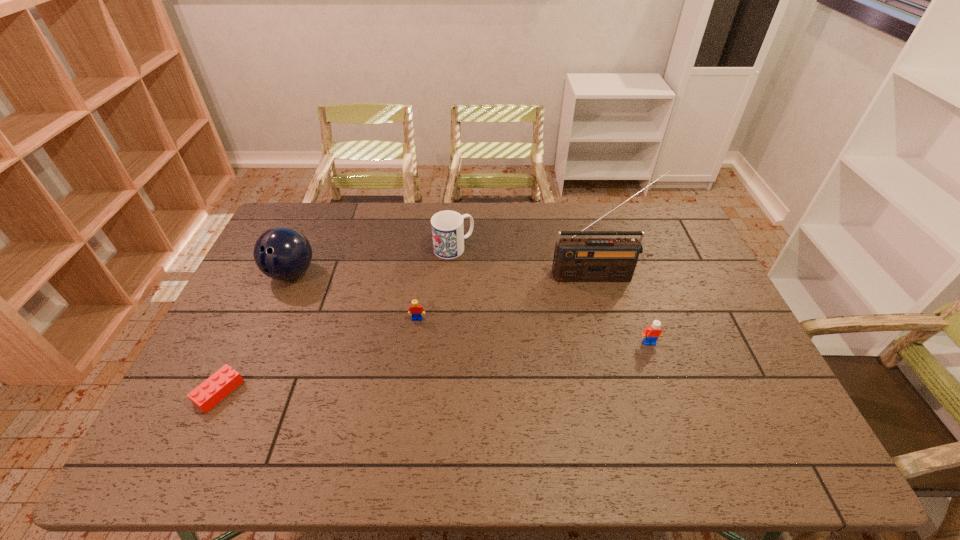
Where is `free space at the left edge of the desktop`? This screenshot has height=540, width=960. free space at the left edge of the desktop is located at coordinates (281, 289).

In order to click on vacant space at the right edge of the desktop in this screenshot , I will do `click(731, 349)`.

At what (x,y) coordinates should I click in order to perform the action: click on free region at the far left corner. Please return your answer as a coordinate pair (x, y). The height and width of the screenshot is (540, 960). Looking at the image, I should click on (317, 202).

You are a GUI agent. You are given a task and a screenshot of the screen. Output one action in this format:
    pyautogui.click(x=<x>, y=<y>)
    Task: Click on the free point at the far right corner
    This screenshot has width=960, height=540.
    Given the screenshot: What is the action you would take?
    645,214

This screenshot has width=960, height=540. Identify the location of free spot at the near right corner of the desktop. (812, 465).

At what (x,y) coordinates should I click in order to perform the action: click on empty space that is in between the radio receiver and the fourth shortest object. Please return your answer as a coordinate pair (x, y). Looking at the image, I should click on (525, 261).

The height and width of the screenshot is (540, 960). What are the coordinates of `free space between the fourth shortest object and the tallest object` in the screenshot? It's located at (525, 261).

At what (x,y) coordinates should I click in order to perform the action: click on free spot between the fourth shortest object and the second tallest object. Please return your answer as a coordinate pair (x, y). This screenshot has height=540, width=960. Looking at the image, I should click on (372, 260).

Identify the location of vacant point located between the farthest Lego and the second tallest object. Image resolution: width=960 pixels, height=540 pixels. (354, 296).

Find the location of a particular element. The height and width of the screenshot is (540, 960). vacant space that's between the nearest object and the radio receiver is located at coordinates (408, 334).